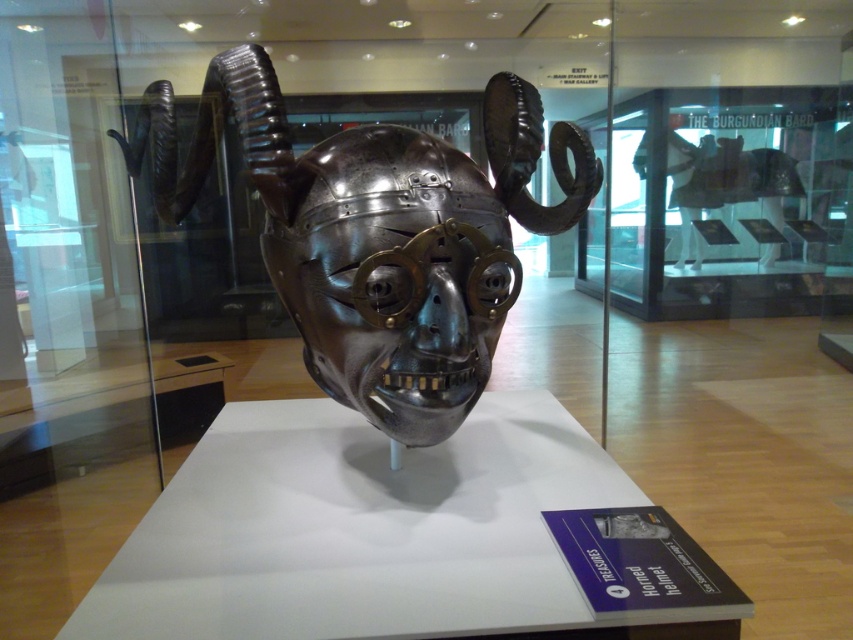
Question: Does polished metal helmet at center have a smaller size compared to polished metal skull at center?

Choices:
 (A) no
 (B) yes

Answer: (A)

Question: Among these objects, which one is farthest from the camera?

Choices:
 (A) polished metal skull at center
 (B) polished metal helmet at center

Answer: (B)

Question: Does polished metal helmet at center have a lesser width compared to polished metal skull at center?

Choices:
 (A) yes
 (B) no

Answer: (B)

Question: Can you confirm if polished metal helmet at center is positioned above polished metal skull at center?

Choices:
 (A) no
 (B) yes

Answer: (B)

Question: Among these objects, which one is nearest to the camera?

Choices:
 (A) polished metal skull at center
 (B) polished metal helmet at center

Answer: (A)